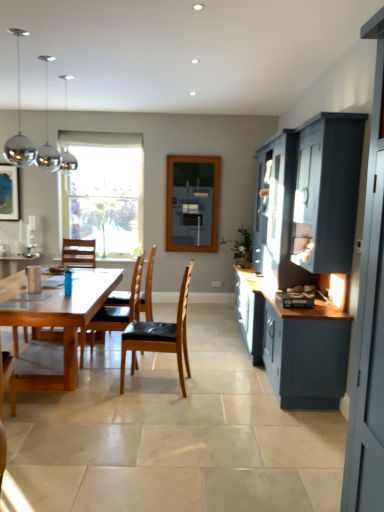
Find the location of a particular element. free location to the left of light brown wooden chair at center, acting as the 1th chair starting from the front is located at coordinates (98, 387).